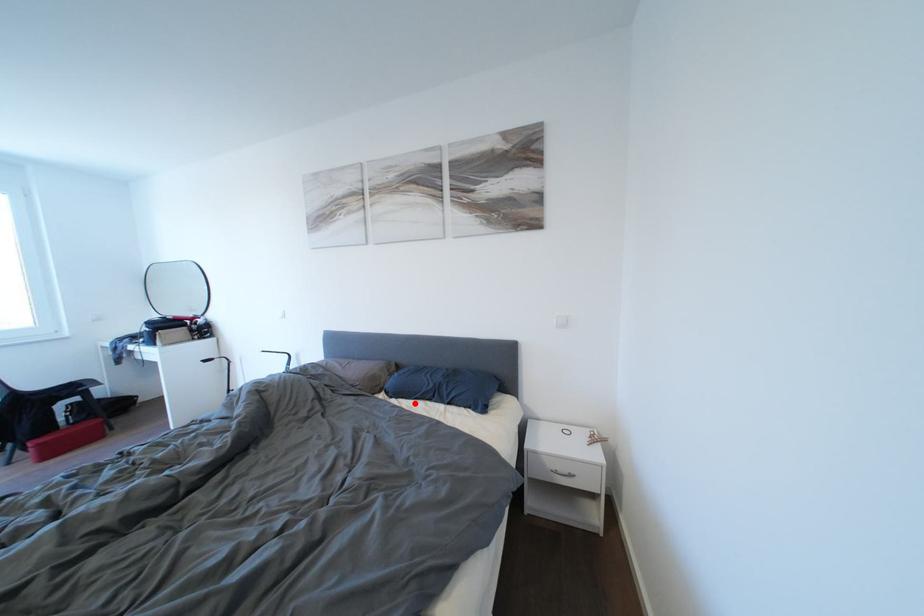
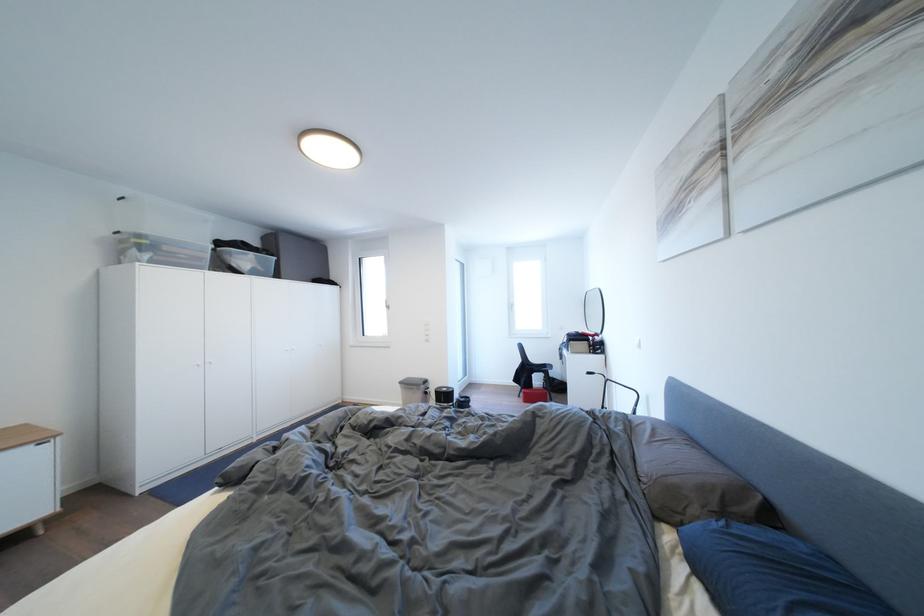
The point at the highlighted location is marked in the first image. Where is the corresponding point in the second image?

(726, 607)